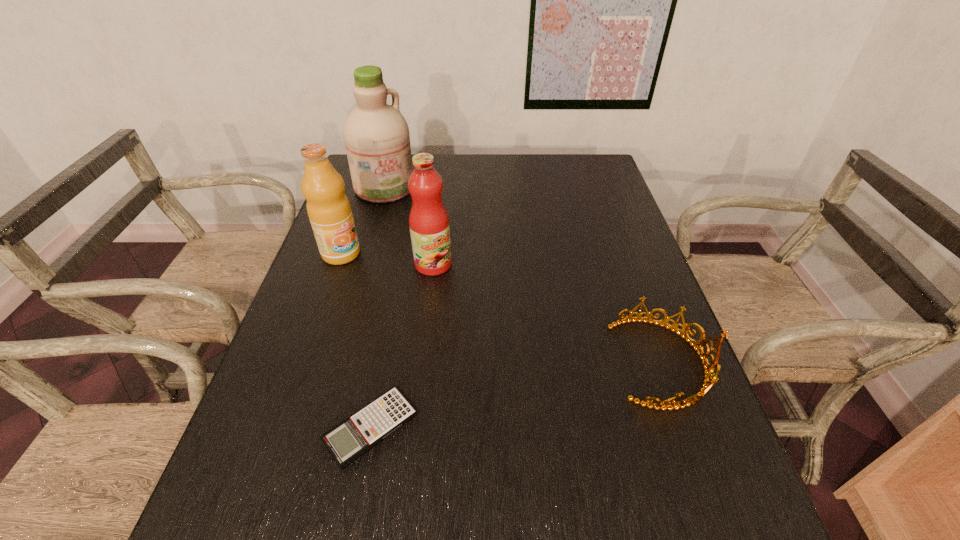
You are a GUI agent. You are given a task and a screenshot of the screen. Output one action in this format:
    pyautogui.click(x=<x>, y=<y>)
    Task: Click on the calculator
    This screenshot has width=960, height=540.
    Given the screenshot: What is the action you would take?
    pyautogui.click(x=347, y=441)

Where is `the rightmost object`? The width and height of the screenshot is (960, 540). the rightmost object is located at coordinates (708, 381).

Identify the location of the fourth tallest object. (708, 381).

This screenshot has height=540, width=960. Identify the location of the left fruit juice. (329, 211).

This screenshot has height=540, width=960. What are the coordinates of `the right fruit juice` in the screenshot? It's located at (429, 225).

Where is `cleansing agent`? Image resolution: width=960 pixels, height=540 pixels. cleansing agent is located at coordinates (376, 135).

In order to click on the tallest object in this screenshot , I will do point(376,135).

Find the location of `free region located on the back of the shortest object`. free region located on the back of the shortest object is located at coordinates (382, 366).

Locate an element on the screen. free space located on the front label of the left fruit juice is located at coordinates (398, 299).

The height and width of the screenshot is (540, 960). I want to click on vacant space located on the front label of the left fruit juice, so click(389, 292).